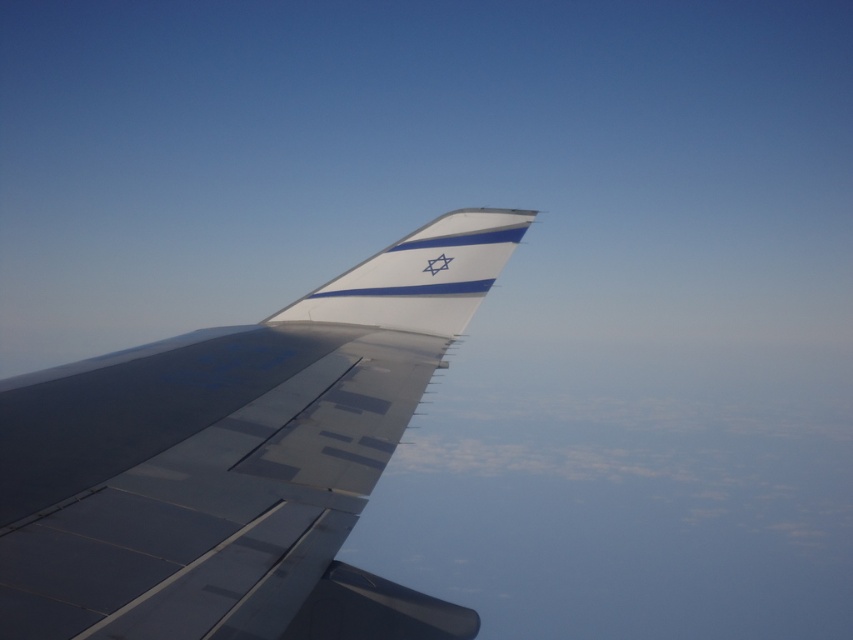
Question: Which point is farther to the camera?

Choices:
 (A) metallic gray wing at center
 (B) white glossy tail at center

Answer: (B)

Question: Is metallic gray wing at center to the left of white glossy tail at center from the viewer's perspective?

Choices:
 (A) no
 (B) yes

Answer: (B)

Question: Does metallic gray wing at center appear on the right side of white glossy tail at center?

Choices:
 (A) no
 (B) yes

Answer: (A)

Question: Is metallic gray wing at center to the left of white glossy tail at center from the viewer's perspective?

Choices:
 (A) yes
 (B) no

Answer: (A)